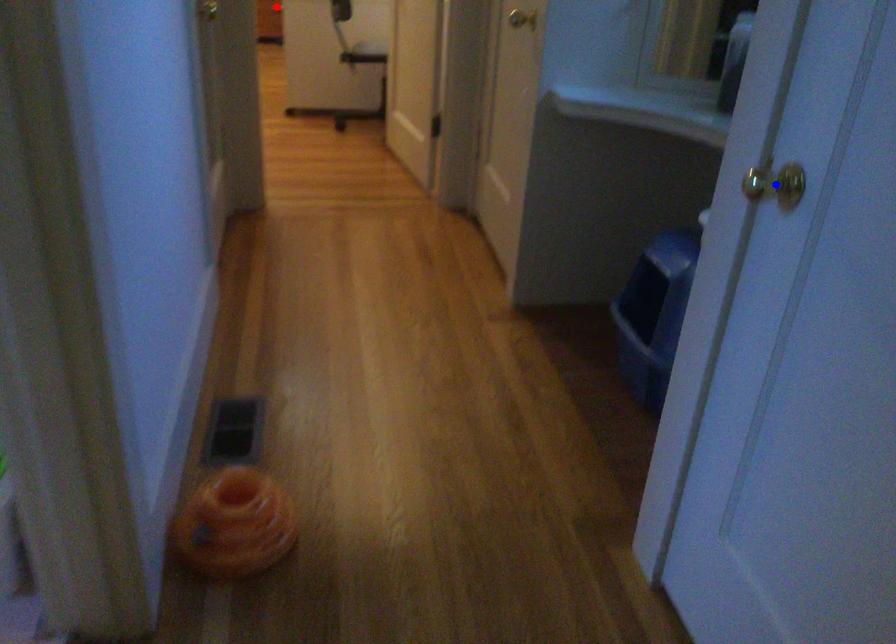
Question: Which of the two points in the image is closer to the camera?

Choices:
 (A) Blue point is closer.
 (B) Red point is closer.

Answer: (A)